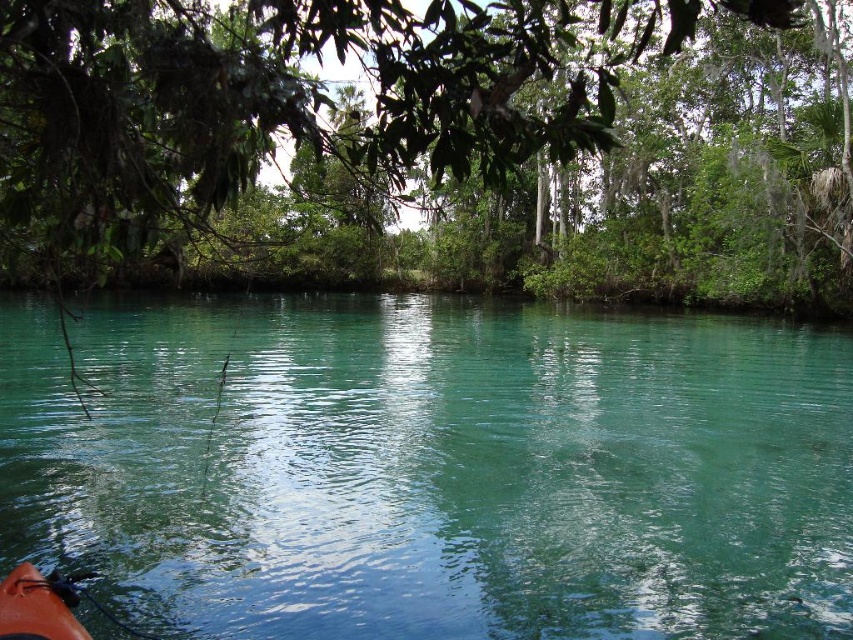
Does teal glossy water at center appear under green leafy tree at upper center?

Yes.

Is point (368, 502) less distant than point (576, 113)?

No, it is behind (576, 113).

Locate an element on the screen. Image resolution: width=853 pixels, height=640 pixels. teal glossy water at center is located at coordinates (432, 468).

Is green leafy tree at upper center to the right of orange matte kayak at lower left from the viewer's perspective?

In fact, green leafy tree at upper center is to the left of orange matte kayak at lower left.

Between green leafy tree at upper center and orange matte kayak at lower left, which one has more height?

With more height is green leafy tree at upper center.

Locate an element on the screen. green leafy tree at upper center is located at coordinates (280, 100).

The image size is (853, 640). I want to click on green leafy tree at upper center, so click(x=280, y=100).

Looking at this image, does teal glossy water at center have a greater width compared to orange matte kayak at lower left?

Indeed, teal glossy water at center has a greater width compared to orange matte kayak at lower left.

Is point (709, 627) closer to camera compared to point (45, 593)?

That is False.

Where is `teal glossy water at center`? This screenshot has height=640, width=853. teal glossy water at center is located at coordinates (432, 468).